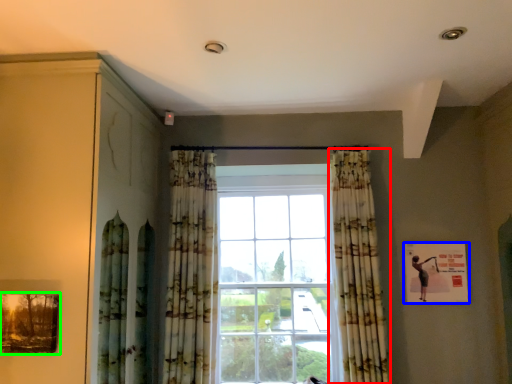
Question: Which object is positioned farthest from curtain (highlighted by a red box)? Select from picture frame (highlighted by a blue box) and picture frame (highlighted by a green box).

Choices:
 (A) picture frame
 (B) picture frame

Answer: (B)